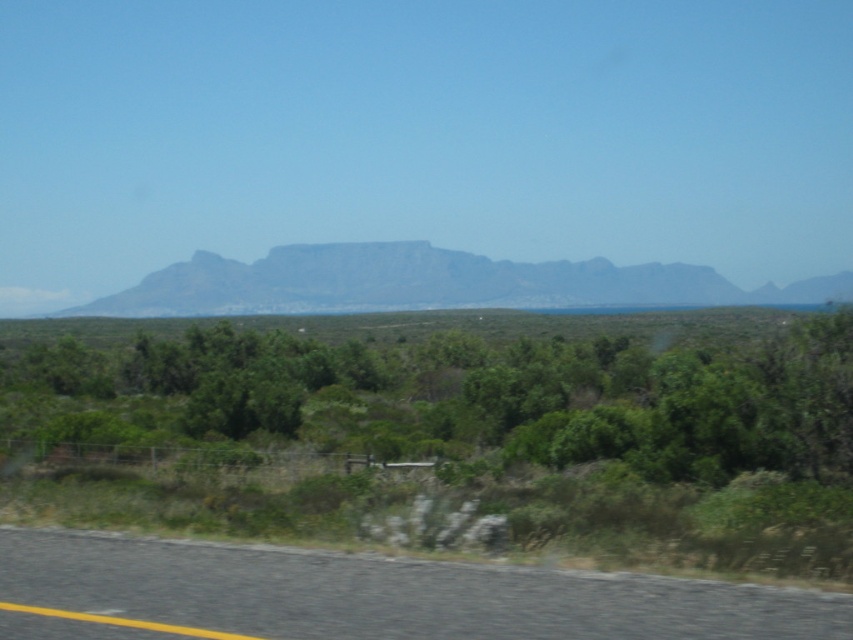
Question: In this image, where is green leafy shrub at center located relative to gray rocky mountain at center?

Choices:
 (A) left
 (B) right

Answer: (A)

Question: Which object is farther from the camera taking this photo?

Choices:
 (A) gray rocky mountain at center
 (B) black asphalt road at lower left

Answer: (A)

Question: Which is farther from the green leafy shrub at center?

Choices:
 (A) gray rocky mountain at center
 (B) black asphalt road at lower left

Answer: (A)

Question: Which point is farther to the camera?

Choices:
 (A) black asphalt road at lower left
 (B) gray rocky mountain at center

Answer: (B)

Question: Where is green leafy shrub at center located in relation to black asphalt road at lower left in the image?

Choices:
 (A) left
 (B) right

Answer: (A)

Question: Is green leafy shrub at center wider than gray rocky mountain at center?

Choices:
 (A) yes
 (B) no

Answer: (B)